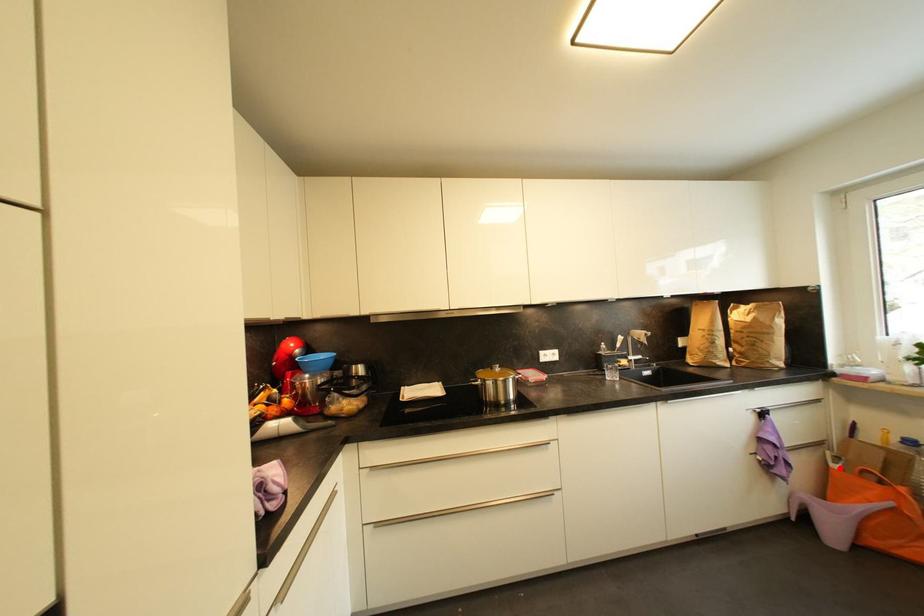
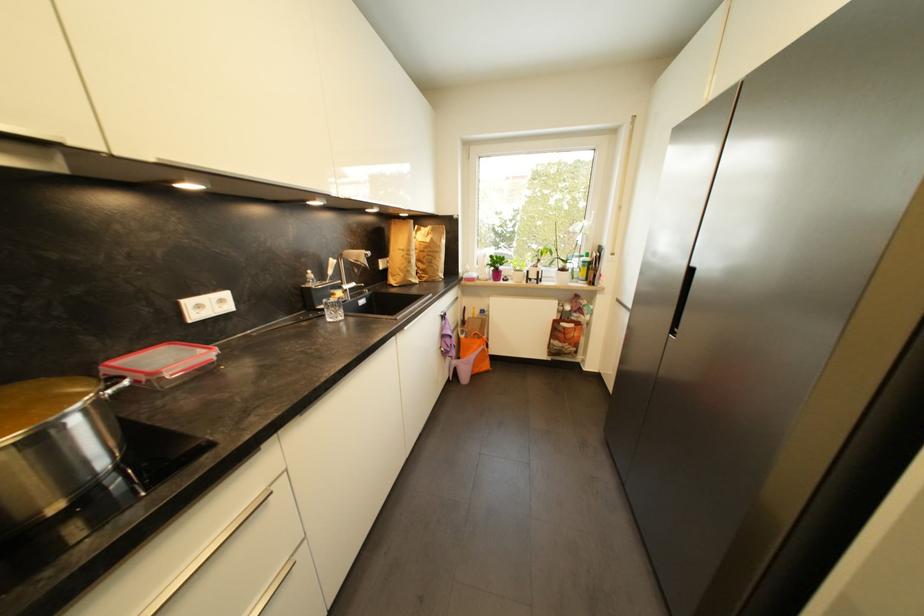
Question: I am providing you with two images of the same scene from different viewpoints. In image1, a red point is highlighted. Considering the same 3D point in image2, which of the following is correct?

Choices:
 (A) It is closer
 (B) It is farther

Answer: (B)